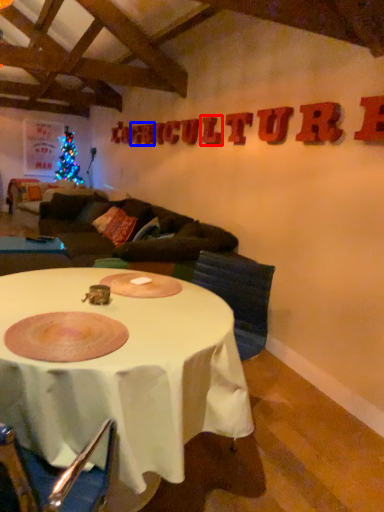
Question: Among these objects, which one is farthest to the camera, letter (highlighted by a red box) or letter (highlighted by a blue box)?

Choices:
 (A) letter
 (B) letter

Answer: (B)